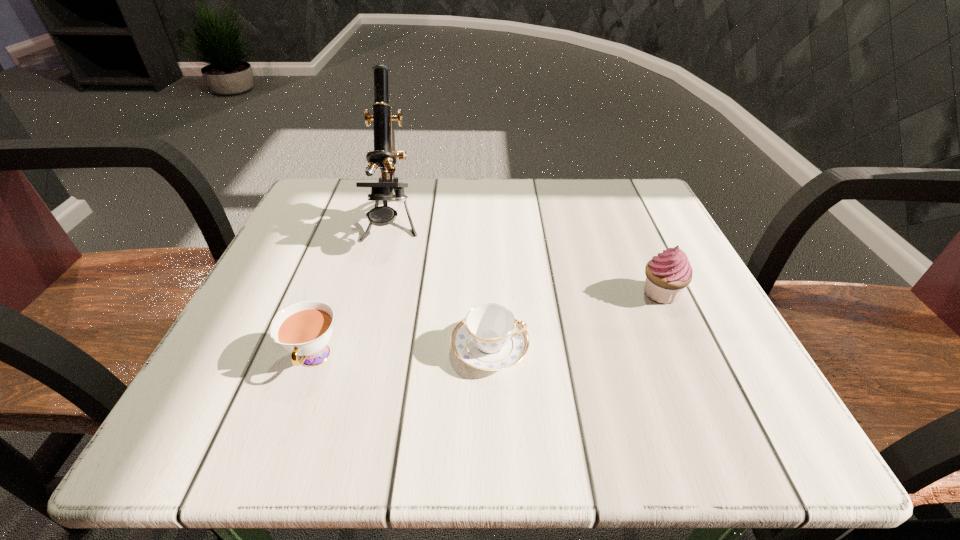
This screenshot has height=540, width=960. I want to click on vacant space at the right edge of the desktop, so click(606, 242).

I want to click on blank space at the far left corner, so click(351, 223).

Where is `vacant space at the near left corner of the desktop`? This screenshot has width=960, height=540. vacant space at the near left corner of the desktop is located at coordinates (186, 442).

The height and width of the screenshot is (540, 960). What are the coordinates of `vacant space at the far right corner of the desktop` in the screenshot? It's located at (597, 223).

You are a GUI agent. You are given a task and a screenshot of the screen. Output one action in this format:
    pyautogui.click(x=<x>, y=<y>)
    Task: Click on the vacant space at the near right corner
    Image resolution: width=960 pixels, height=540 pixels.
    Given the screenshot: What is the action you would take?
    pyautogui.click(x=666, y=409)

This screenshot has width=960, height=540. What are the coordinates of `vacant region between the second farthest object and the shorter teacup` in the screenshot? It's located at (575, 321).

Find the location of a particular element. The image size is (960, 540). free spot between the cupcake and the right teacup is located at coordinates (575, 321).

The width and height of the screenshot is (960, 540). In order to click on unoccupied area between the farthest object and the second tallest object in this screenshot , I will do `click(527, 259)`.

Identify the location of free spot between the third tallest object and the shorter teacup. [x=402, y=353].

Locate an element on the screen. This screenshot has width=960, height=540. free space between the tallest object and the third object from left to right is located at coordinates (442, 287).